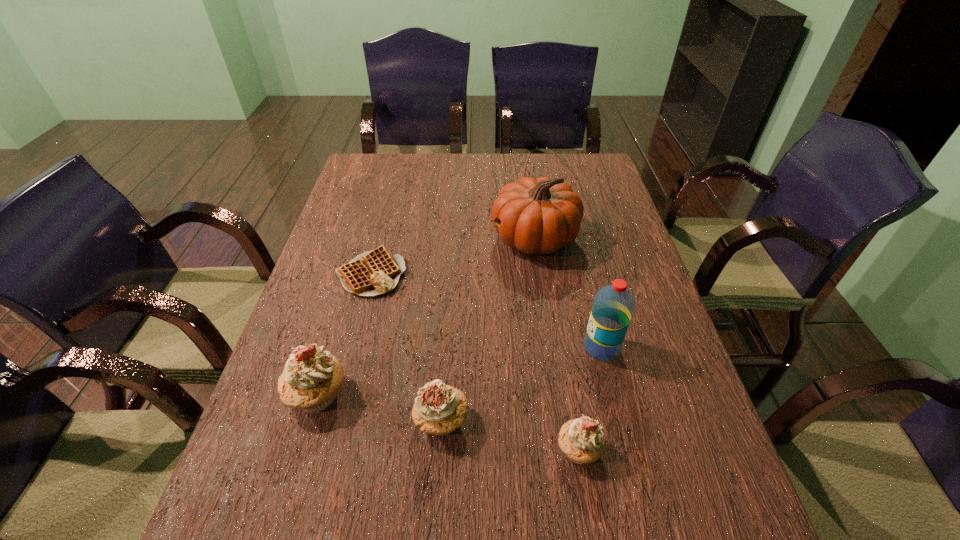
Locate an element on the screen. free region located on the back of the second cupcake from right to left is located at coordinates (448, 324).

Image resolution: width=960 pixels, height=540 pixels. Find the location of `vacant space situated on the left of the shortest cupcake`. vacant space situated on the left of the shortest cupcake is located at coordinates (463, 450).

Image resolution: width=960 pixels, height=540 pixels. In order to click on vacant point located 0.050m on the face of the pumpkin in this screenshot , I will do `click(474, 238)`.

Find the location of `vacant space located on the face of the pumpkin`. vacant space located on the face of the pumpkin is located at coordinates (474, 238).

Locate an element on the screen. vacant space situated 0.050m on the face of the pumpkin is located at coordinates (474, 238).

I want to click on free region located 0.220m on the front label of the water bottle, so click(x=489, y=347).

You are a GUI agent. You are given a task and a screenshot of the screen. Output one action in this format:
    pyautogui.click(x=<x>, y=<y>)
    Task: Click on the vacant space located 0.290m on the front label of the water bottle
    The height and width of the screenshot is (540, 960).
    Given the screenshot: What is the action you would take?
    pyautogui.click(x=459, y=347)

At what (x,y) coordinates should I click in order to perform the action: click on vacant space positioned on the front label of the water bottle. Please return your answer as a coordinate pair (x, y). The height and width of the screenshot is (540, 960). Looking at the image, I should click on (540, 347).

You are a GUI agent. You are given a task and a screenshot of the screen. Output one action in this format:
    pyautogui.click(x=<x>, y=<y>)
    Task: Click on the free point located 0.170m on the right of the waffle
    This screenshot has width=960, height=540.
    Given the screenshot: What is the action you would take?
    pyautogui.click(x=468, y=274)

Identify the location of cupcake that is at the left edge. (311, 379).